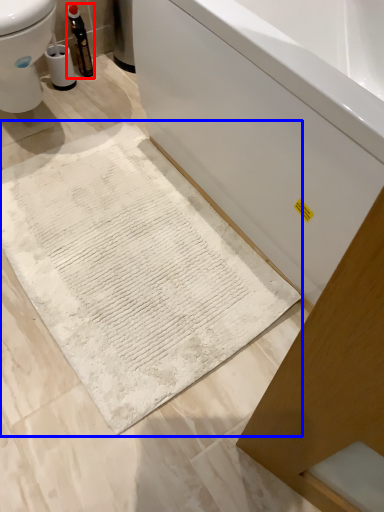
Question: Which object is closer to the camera taking this photo, bottle (highlighted by a red box) or bath mat (highlighted by a blue box)?

Choices:
 (A) bottle
 (B) bath mat

Answer: (B)